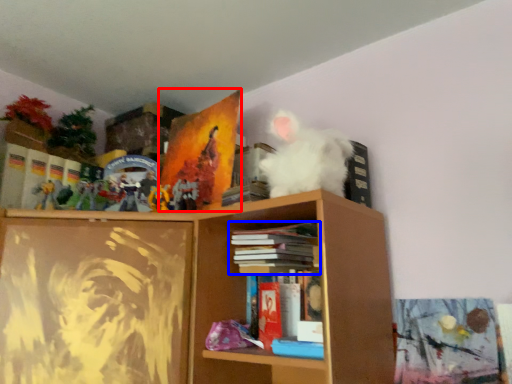
Question: Which object appears closest to the camera in this image, paperback book (highlighted by a red box) or book (highlighted by a blue box)?

Choices:
 (A) paperback book
 (B) book

Answer: (B)